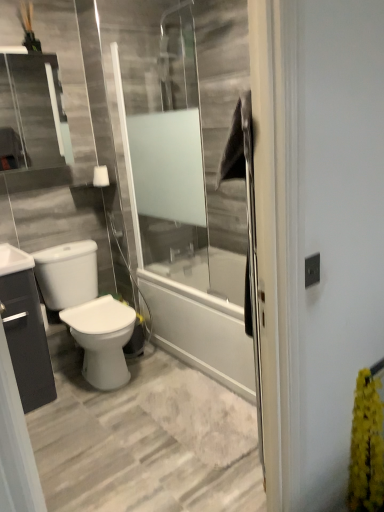
Question: From the image's perspective, is yellow fluffy plant at right below matte black cabinet at left?

Choices:
 (A) no
 (B) yes

Answer: (B)

Question: From the image's perspective, would you say yellow fluffy plant at right is positioned over matte black cabinet at left?

Choices:
 (A) no
 (B) yes

Answer: (A)

Question: From a real-world perspective, is yellow fluffy plant at right below matte black cabinet at left?

Choices:
 (A) yes
 (B) no

Answer: (A)

Question: Is yellow fluffy plant at right positioned beyond the bounds of matte black cabinet at left?

Choices:
 (A) yes
 (B) no

Answer: (A)

Question: Could you tell me if yellow fluffy plant at right is turned towards matte black cabinet at left?

Choices:
 (A) yes
 (B) no

Answer: (B)

Question: From a real-world perspective, relative to white glossy toilet at lower left, is yellow fluffy plant at right vertically above or below?

Choices:
 (A) below
 (B) above

Answer: (A)

Question: Looking at their shapes, would you say yellow fluffy plant at right is wider or thinner than white glossy toilet at lower left?

Choices:
 (A) wide
 (B) thin

Answer: (B)

Question: Is point (357, 481) positioned closer to the camera than point (114, 369)?

Choices:
 (A) closer
 (B) farther

Answer: (A)

Question: Considering the relative positions of yellow fluffy plant at right and white glossy toilet at lower left in the image provided, is yellow fluffy plant at right to the left or to the right of white glossy toilet at lower left?

Choices:
 (A) left
 (B) right

Answer: (B)

Question: Is yellow fluffy plant at right bigger or smaller than matte black cabinet at left?

Choices:
 (A) small
 (B) big

Answer: (A)

Question: Considering the positions of yellow fluffy plant at right and matte black cabinet at left in the image, is yellow fluffy plant at right wider or thinner than matte black cabinet at left?

Choices:
 (A) wide
 (B) thin

Answer: (B)

Question: From a real-world perspective, relative to matte black cabinet at left, is yellow fluffy plant at right vertically above or below?

Choices:
 (A) above
 (B) below

Answer: (B)

Question: In the image, is yellow fluffy plant at right positioned in front of or behind matte black cabinet at left?

Choices:
 (A) front
 (B) behind

Answer: (A)

Question: Considering the relative positions of white glossy toilet at lower left and yellow fluffy plant at right in the image provided, is white glossy toilet at lower left to the left or to the right of yellow fluffy plant at right?

Choices:
 (A) left
 (B) right

Answer: (A)

Question: Considering the positions of white glossy toilet at lower left and yellow fluffy plant at right in the image, is white glossy toilet at lower left bigger or smaller than yellow fluffy plant at right?

Choices:
 (A) big
 (B) small

Answer: (A)